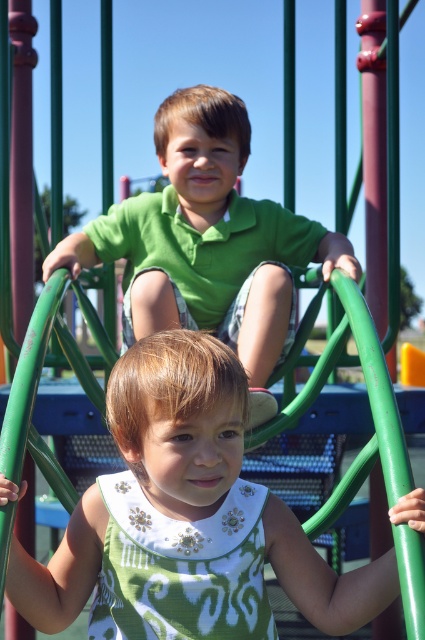
Question: Which of the following is the farthest from the observer?

Choices:
 (A) green matte shirt at upper center
 (B) green fabric dress at center

Answer: (A)

Question: Is green fabric dress at center further to the viewer compared to green matte shirt at upper center?

Choices:
 (A) no
 (B) yes

Answer: (A)

Question: Can you confirm if green fabric dress at center is positioned to the right of green matte shirt at upper center?

Choices:
 (A) yes
 (B) no

Answer: (A)

Question: Which object is farther from the camera taking this photo?

Choices:
 (A) green fabric dress at center
 (B) green matte shirt at upper center

Answer: (B)

Question: Is green fabric dress at center positioned behind green matte shirt at upper center?

Choices:
 (A) yes
 (B) no

Answer: (B)